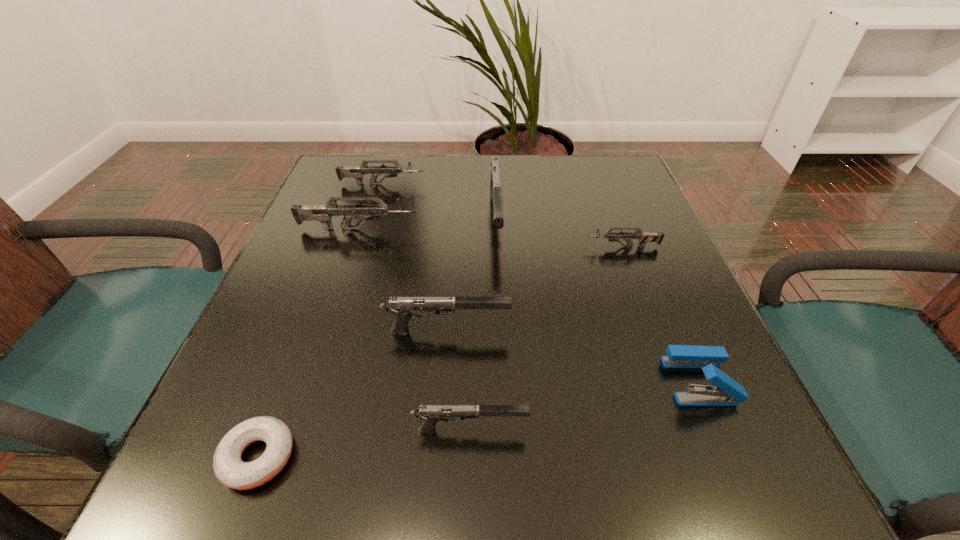
Where is `vacant space at the far edge of the desktop`? vacant space at the far edge of the desktop is located at coordinates (469, 174).

In the image, there is a desktop. Where is `blank space at the left edge`? The height and width of the screenshot is (540, 960). blank space at the left edge is located at coordinates (314, 244).

At what (x,y) coordinates should I click in order to perform the action: click on vacant space at the right edge of the desktop. Please return your answer as a coordinate pair (x, y). Looking at the image, I should click on (646, 261).

Identify the location of vacant area at the far left corner of the desktop. (351, 193).

This screenshot has width=960, height=540. I want to click on vacant space at the far right corner of the desktop, so click(x=634, y=178).

This screenshot has width=960, height=540. I want to click on vacant space that is in between the stapler and the tallest gun, so click(598, 300).

The image size is (960, 540). What are the coordinates of `vacant space that is in between the biggest grey gun and the nearest gun` in the screenshot? It's located at (415, 329).

At what (x,y) coordinates should I click in order to perform the action: click on free space between the shortest object and the second nearest grey gun. Please return your answer as a coordinate pair (x, y). Looking at the image, I should click on (308, 343).

I want to click on vacant space that is in between the blue stapler and the shortest object, so click(x=479, y=419).

Locate an element on the screen. free point between the smallest gray gun and the farthest gray gun is located at coordinates (484, 325).